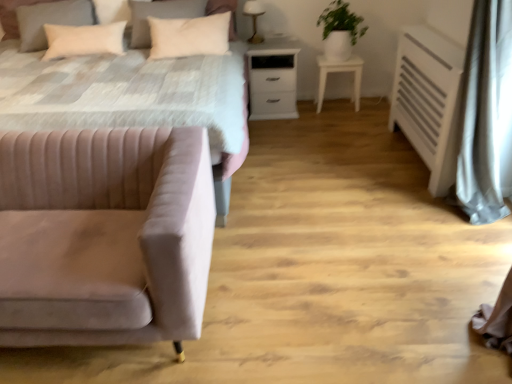
What are the coordinates of `vacant area situated below white sheer curtain at right (from a real-world perspective)` in the screenshot? It's located at (498, 241).